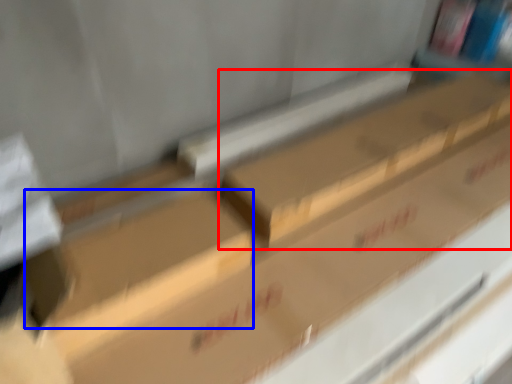
Question: Which of the following is the farthest to the observer, box (highlighted by a red box) or block (highlighted by a blue box)?

Choices:
 (A) box
 (B) block

Answer: (A)